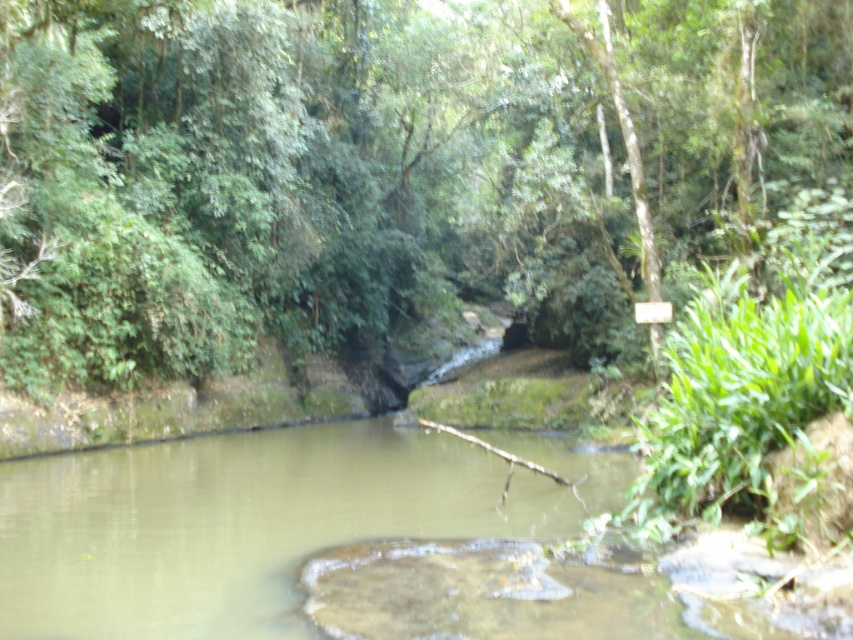
You are standing at the center of the image and want to reach the wooden signpost on the right side. There is a point at coordinates (387,170) on the green leafy tree at center. Can you walk directly towards the wooden signpost without passing through the green leafy tree at center?

The point at coordinates (387,170) is on the green leafy tree at center, so walking directly towards the wooden signpost on the right side would require passing through the green leafy tree at center. Therefore, you cannot walk directly without going through the tree.

You are standing in the middle of the river and see the green leafy tree at center and the green mossy rock at center. Which object is closer to your right side?

The green leafy tree at center is positioned on the right side of green mossy rock at center, so the green leafy tree at center is closer to your right side.

You are standing at the edge of the river and want to reach both the green leafy tree at center and the green mossy rock at center. Which one is closer to you?

Both the green leafy tree at center and the green mossy rock at center are 10.01 meters away from each other. Therefore, they are equidistant from your current position at the river edge.